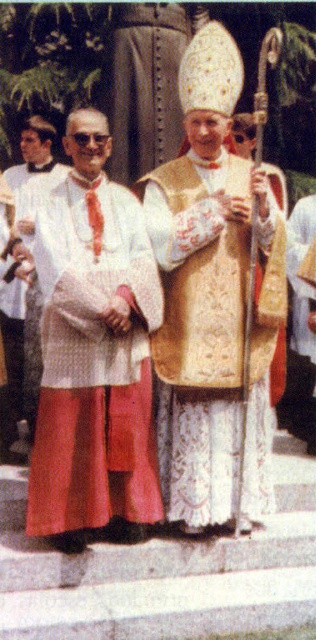
Question: Is gold embroidered vestment at center closer to camera compared to matte white robe at left?

Choices:
 (A) yes
 (B) no

Answer: (A)

Question: Is matte white robe at center above gold textured vestment at center?

Choices:
 (A) no
 (B) yes

Answer: (A)

Question: Which point is closer to the camera?

Choices:
 (A) matte white robe at center
 (B) gold embroidered vestment at center
 (C) matte white robe at left

Answer: (A)

Question: Among these points, which one is farthest from the camera?

Choices:
 (A) (289, 266)
 (B) (187, 326)

Answer: (A)

Question: Does matte white robe at center lie in front of matte white robe at left?

Choices:
 (A) yes
 (B) no

Answer: (A)

Question: Which object is farther from the camera taking this photo?

Choices:
 (A) gold textured vestment at center
 (B) matte white robe at center
 (C) gold embroidered vestment at center
 (D) matte white robe at left

Answer: (A)